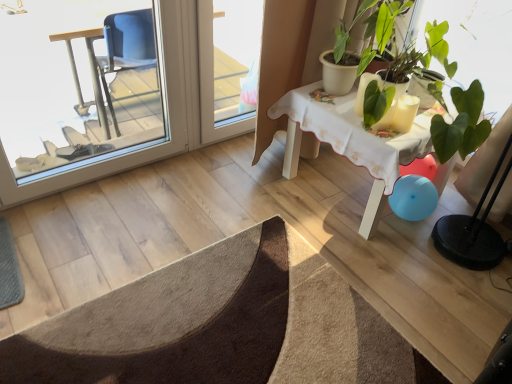
This screenshot has height=384, width=512. In order to click on space that is in front of white wooden table at upper right in this screenshot , I will do `click(368, 269)`.